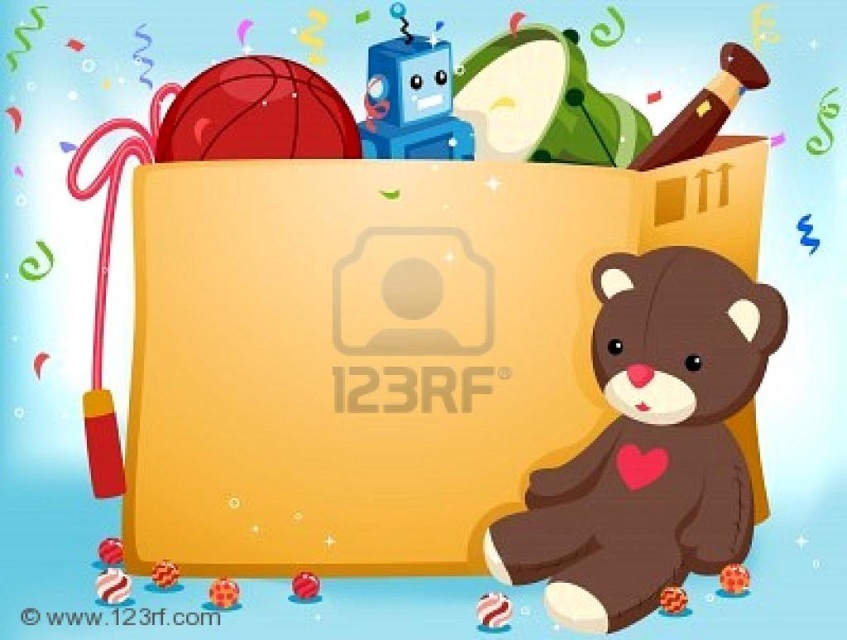
Can you confirm if brown plush bear at lower right is positioned to the right of green fabric pillow at upper center?

Correct, you'll find brown plush bear at lower right to the right of green fabric pillow at upper center.

Does point (577, 472) lie in front of point (480, 51)?

Yes, point (577, 472) is closer to viewer.

Image resolution: width=847 pixels, height=640 pixels. In order to click on brown plush bear at lower right in this screenshot , I will do `click(649, 442)`.

Identify the location of brown plush bear at lower right. (649, 442).

Who is higher up, smooth orange ball at lower center or shiny red ball at center?

smooth orange ball at lower center

Measure the distance between smooth orange ball at lower center and camera.

24.40 inches

Locate an element on the screen. The image size is (847, 640). smooth orange ball at lower center is located at coordinates (734, 579).

Describe the element at coordinates (649, 442) in the screenshot. I see `brown plush bear at lower right` at that location.

Is point (735, 292) farther from camera compared to point (119, 540)?

No.

This screenshot has width=847, height=640. What do you see at coordinates (649, 442) in the screenshot?
I see `brown plush bear at lower right` at bounding box center [649, 442].

This screenshot has width=847, height=640. I want to click on brown plush bear at lower right, so click(x=649, y=442).